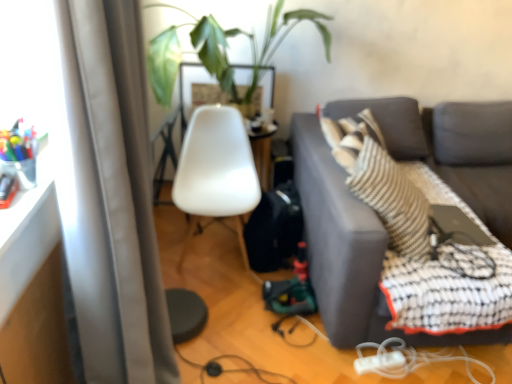
Identify the location of free region on the left part of white plastic extension cord at lower center. click(x=340, y=364).